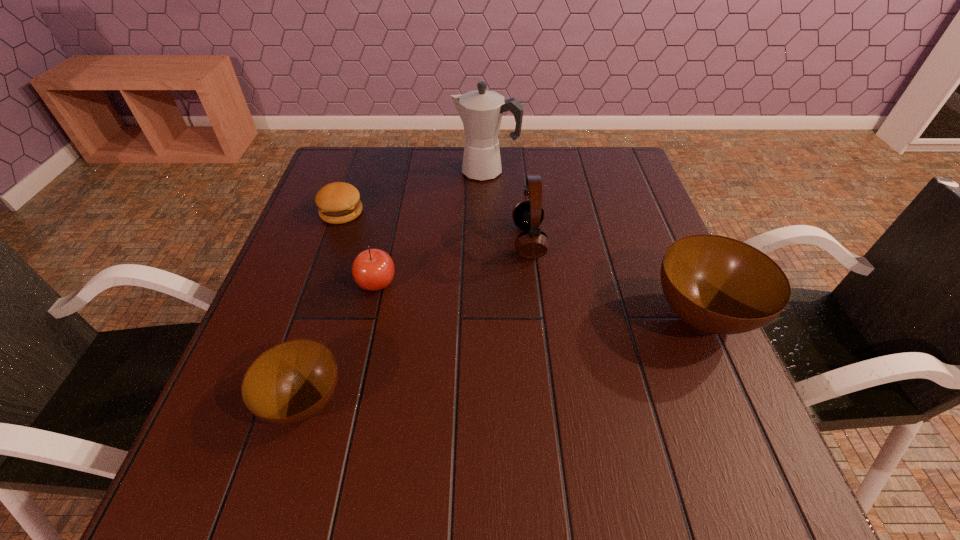
Find the location of a particular element. This screenshot has width=960, height=540. hamburger present at the left edge is located at coordinates (338, 202).

Find the location of a particular element. object located in the right edge section of the desktop is located at coordinates (719, 285).

Identify the location of object situated at the near left corner. point(291,382).

In the image, there is a desktop. Where is `free region at the far edge`? This screenshot has width=960, height=540. free region at the far edge is located at coordinates (550, 147).

Find the location of a particular element. This screenshot has width=960, height=540. free point at the near edge is located at coordinates (635, 405).

Identify the location of vacant space at the left edge. (271, 344).

In the image, there is a desktop. Identify the location of vacant space at the right edge. The width and height of the screenshot is (960, 540). (630, 293).

Image resolution: width=960 pixels, height=540 pixels. What are the coordinates of `free space at the far left corner` in the screenshot? It's located at (324, 180).

At what (x,y) coordinates should I click in order to perform the action: click on vacant point at the near left corner. Please return your answer as a coordinate pair (x, y). Looking at the image, I should click on (234, 395).

In the image, there is a desktop. Where is `free space at the far right corner`? This screenshot has width=960, height=540. free space at the far right corner is located at coordinates coord(630,168).